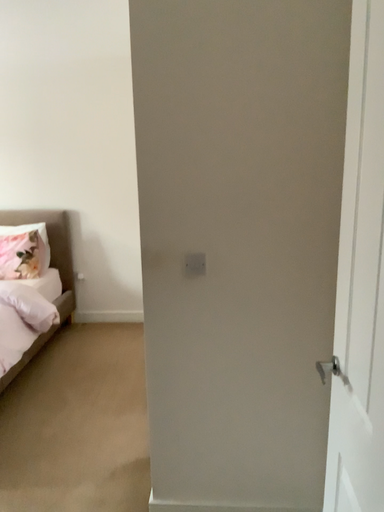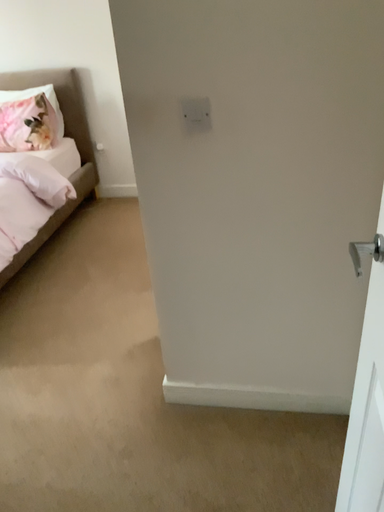
Question: Which way did the camera rotate in the video?

Choices:
 (A) rotated upward
 (B) rotated downward

Answer: (B)